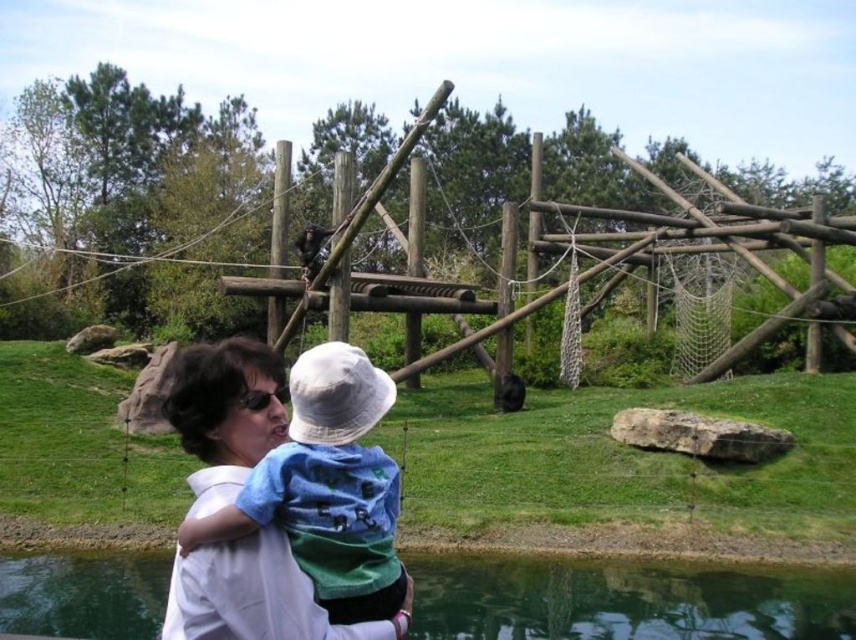
Which is more to the left, wooden at upper center or blue cotton shirt at center?

Positioned to the left is wooden at upper center.

Which is in front, point (94, 278) or point (224, 376)?

Point (224, 376)

Measure the distance between wooden at upper center and camera.

A distance of 13.39 meters exists between wooden at upper center and camera.

What are the coordinates of `wooden at upper center` in the screenshot? It's located at (697, 237).

What do you see at coordinates (623, 600) in the screenshot?
I see `clear water at lower center` at bounding box center [623, 600].

Image resolution: width=856 pixels, height=640 pixels. Find the location of `clear water at lower center`. clear water at lower center is located at coordinates (623, 600).

Image resolution: width=856 pixels, height=640 pixels. I want to click on clear water at lower center, so click(623, 600).

Can you confirm if wooden at upper center is bigger than clear water at lower center?

Correct, wooden at upper center is larger in size than clear water at lower center.

Between wooden at upper center and clear water at lower center, which one has more height?

wooden at upper center is taller.

Who is more forward, (821, 310) or (414, 621)?

Point (414, 621)

This screenshot has height=640, width=856. What are the coordinates of `wooden at upper center` in the screenshot? It's located at (697, 237).